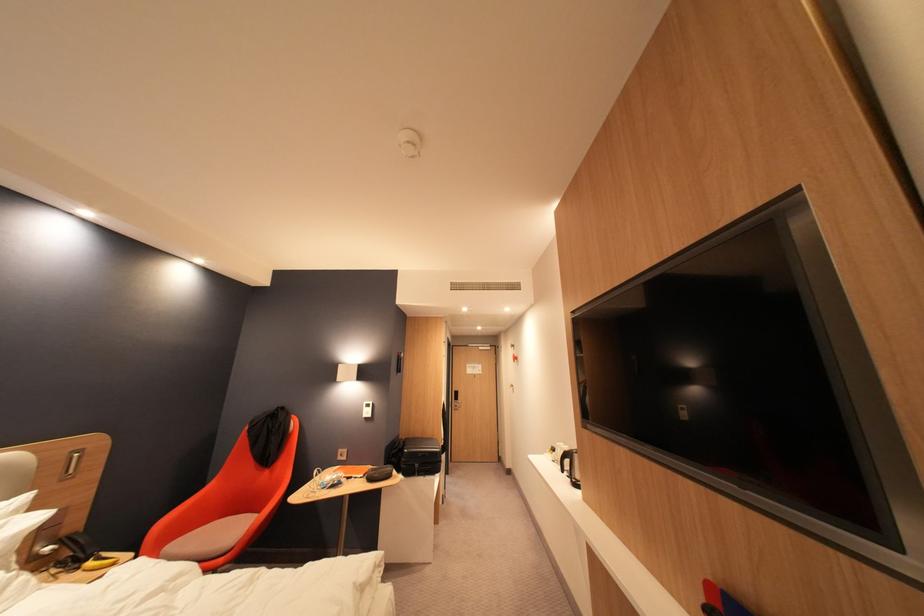
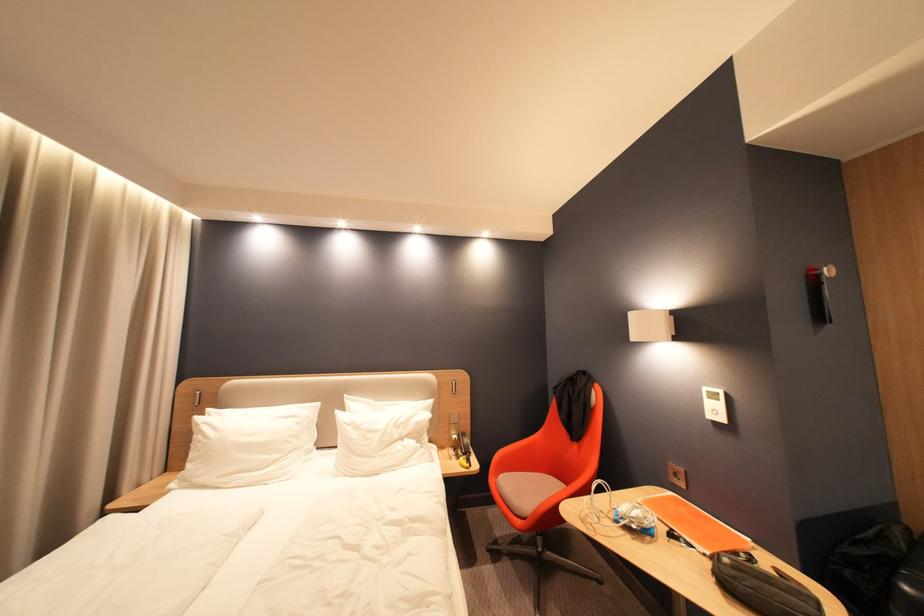
Locate, in the second image, the point that corresponds to the point at 410,355 in the first image.

(830, 270)